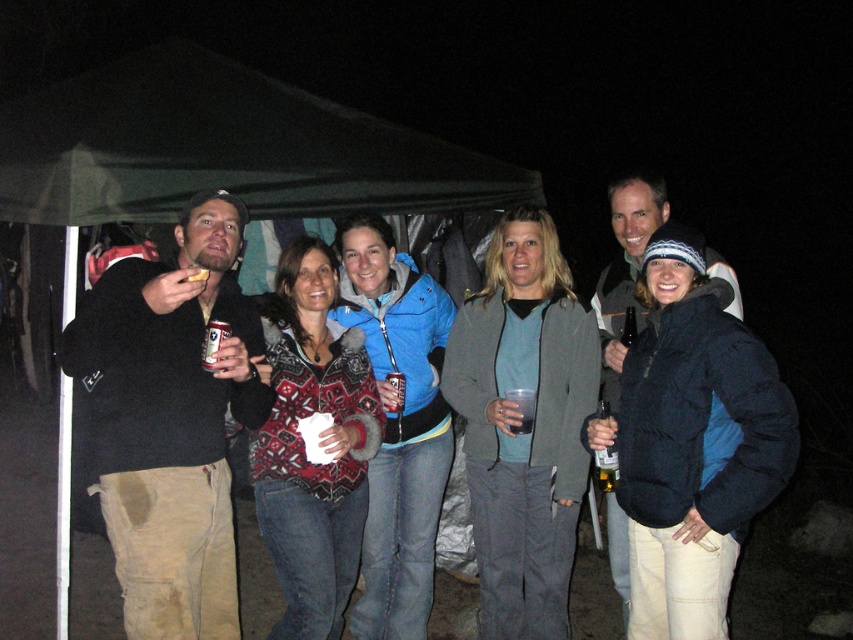
Is point (764, 486) less distant than point (526, 406)?

Yes, it is in front of point (526, 406).

Find the location of a particular element. The image size is (853, 640). dark blue puffy jacket at center is located at coordinates (692, 442).

Does point (686, 394) come behind point (531, 419)?

No, (686, 394) is closer to viewer.

You are a GUI agent. You are given a task and a screenshot of the screen. Output one action in this format:
    pyautogui.click(x=<x>, y=<y>)
    Task: Click on the dark blue puffy jacket at center
    The image size is (853, 640).
    Given the screenshot: What is the action you would take?
    pyautogui.click(x=692, y=442)

Is green fabric tent at center taller than dark blue puffy jacket at center?

Yes.

Which is above, green fabric tent at center or dark blue puffy jacket at center?

Positioned higher is green fabric tent at center.

This screenshot has height=640, width=853. What do you see at coordinates (219, 150) in the screenshot?
I see `green fabric tent at center` at bounding box center [219, 150].

Where is `green fabric tent at center`? Image resolution: width=853 pixels, height=640 pixels. green fabric tent at center is located at coordinates click(219, 150).

Is dark blue puffy jacket at center bigger than blue fleece jacket at center?

Incorrect, dark blue puffy jacket at center is not larger than blue fleece jacket at center.

Is dark blue puffy jacket at center in front of blue fleece jacket at center?

Yes, dark blue puffy jacket at center is in front of blue fleece jacket at center.

Does point (627, 508) lie in front of point (431, 413)?

Yes, point (627, 508) is closer to viewer.

I want to click on dark blue puffy jacket at center, so click(692, 442).